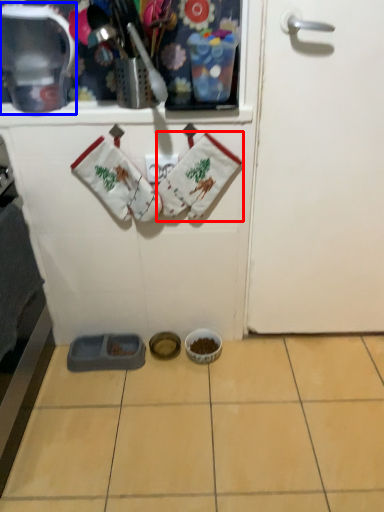
Question: Which of the following is the closest to the observer, baby clothe (highlighted by a red box) or appliance (highlighted by a blue box)?

Choices:
 (A) baby clothe
 (B) appliance

Answer: (B)